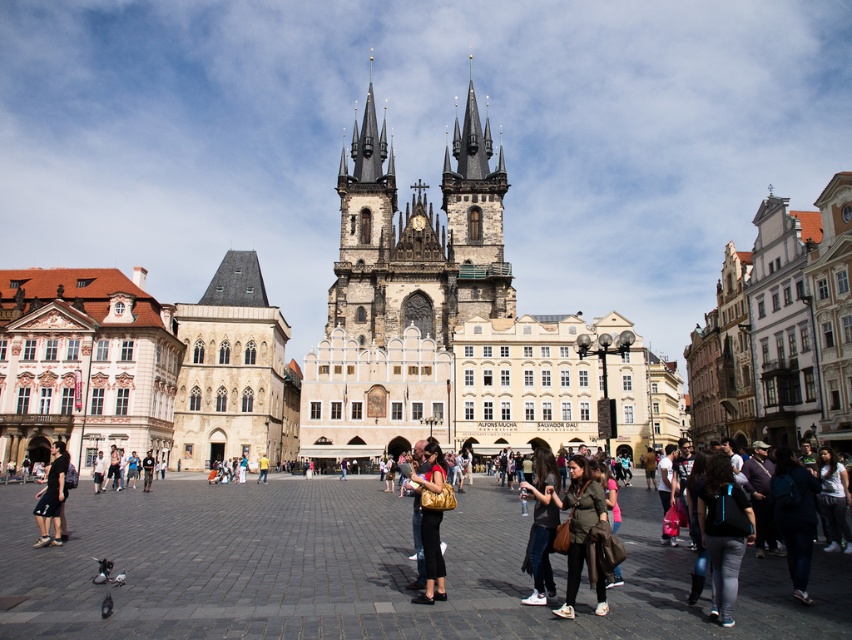
Question: Which of these objects is positioned farthest from the white cotton shirt at lower right?

Choices:
 (A) dark blue jeans at lower left
 (B) denim jacket at lower right
 (C) dark blue fabric backpack at lower right
 (D) stone gothic church at center

Answer: (D)

Question: Is stone gothic church at center behind denim jacket at lower right?

Choices:
 (A) yes
 (B) no

Answer: (A)

Question: Which point appears closest to the camera in this image?

Choices:
 (A) (715, 573)
 (B) (672, 536)

Answer: (A)

Question: Does dark green fabric jacket at lower right have a larger size compared to dark gray fabric jacket at center?

Choices:
 (A) no
 (B) yes

Answer: (A)

Question: From the image, what is the correct spatial relationship of dark blue fabric backpack at lower right in relation to denim jacket at lower right?

Choices:
 (A) below
 (B) above

Answer: (B)

Question: Which point is closer to the camera?

Choices:
 (A) (536, 545)
 (B) (732, 579)
 (C) (665, 467)

Answer: (B)